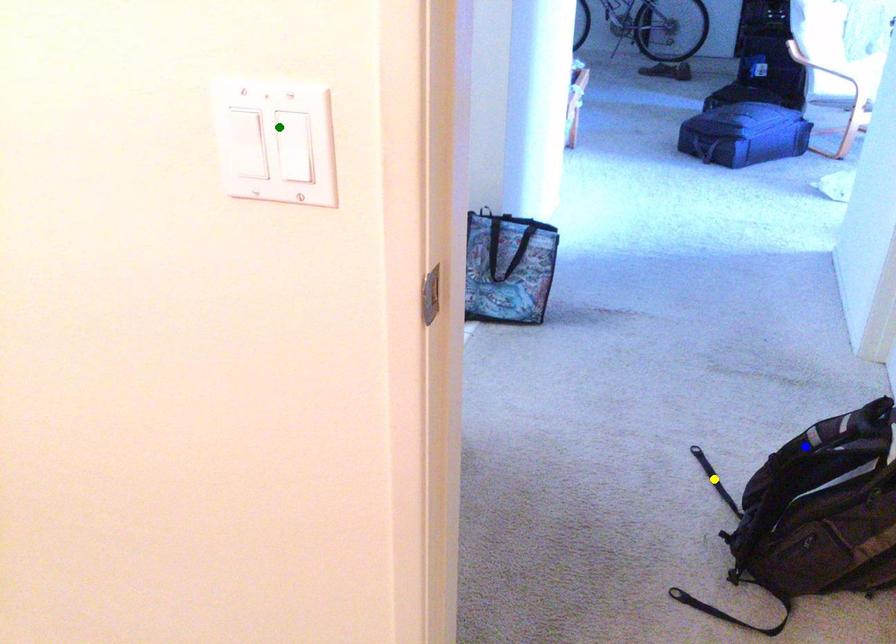
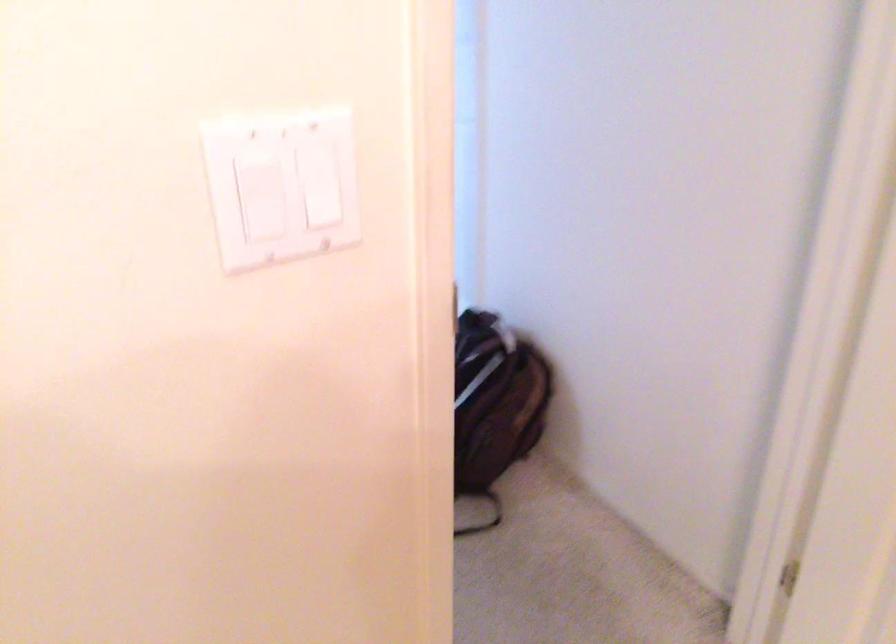
I am providing you with two images of the same scene from different viewpoints. Three points are marked in image1. Which point corresponds to a part or object that is occluded in image2?In image1, three points are marked. Which of them correspond to a part or object that is occluded in image2?Among the three points shown in image1, which one corresponds to a part or object that is no longer visible due to occlusion in image2?

Invisible in image2: blue point, yellow point.